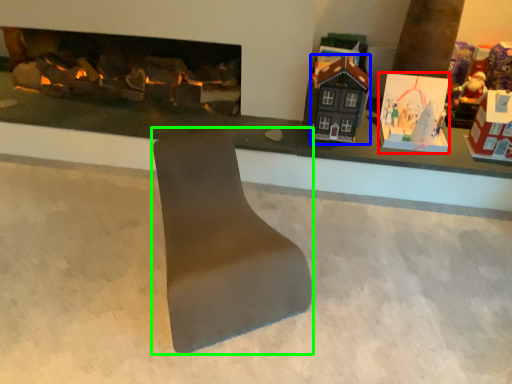
Question: Estimate the real-world distances between objects in this image. Which object is farther from toy (highlighted by a red box), toy (highlighted by a blue box) or footrest (highlighted by a green box)?

Choices:
 (A) toy
 (B) footrest

Answer: (B)